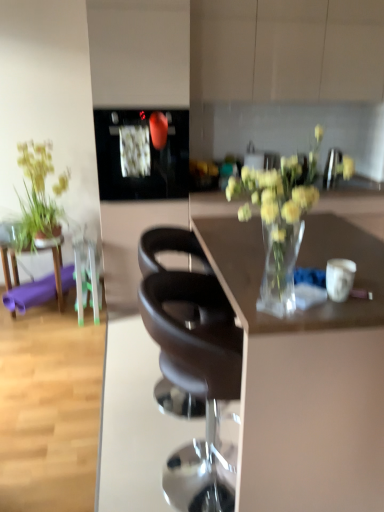
Question: Are purple rubber mat at left and translucent glass vase at center far apart?

Choices:
 (A) no
 (B) yes

Answer: (B)

Question: Does purple rubber mat at left have a lesser width compared to translucent glass vase at center?

Choices:
 (A) yes
 (B) no

Answer: (B)

Question: Considering the relative sizes of purple rubber mat at left and translucent glass vase at center in the image provided, is purple rubber mat at left bigger than translucent glass vase at center?

Choices:
 (A) yes
 (B) no

Answer: (A)

Question: Is purple rubber mat at left oriented away from translucent glass vase at center?

Choices:
 (A) yes
 (B) no

Answer: (B)

Question: From a real-world perspective, is purple rubber mat at left physically below translucent glass vase at center?

Choices:
 (A) yes
 (B) no

Answer: (A)

Question: Can you confirm if purple rubber mat at left is shorter than translucent glass vase at center?

Choices:
 (A) no
 (B) yes

Answer: (A)

Question: From a real-world perspective, does transparent glass vase at center stand above purple rubber mat at left?

Choices:
 (A) yes
 (B) no

Answer: (A)

Question: From the image's perspective, does transparent glass vase at center appear lower than purple rubber mat at left?

Choices:
 (A) no
 (B) yes

Answer: (B)

Question: Considering the relative sizes of transparent glass vase at center and purple rubber mat at left in the image provided, is transparent glass vase at center shorter than purple rubber mat at left?

Choices:
 (A) yes
 (B) no

Answer: (B)

Question: Does transparent glass vase at center have a smaller size compared to purple rubber mat at left?

Choices:
 (A) no
 (B) yes

Answer: (A)

Question: Is transparent glass vase at center wider than purple rubber mat at left?

Choices:
 (A) no
 (B) yes

Answer: (B)

Question: Can you confirm if transparent glass vase at center is positioned to the right of purple rubber mat at left?

Choices:
 (A) no
 (B) yes

Answer: (B)

Question: Considering the relative sizes of purple rubber mat at left and black glossy microwave at upper center in the image provided, is purple rubber mat at left smaller than black glossy microwave at upper center?

Choices:
 (A) no
 (B) yes

Answer: (B)